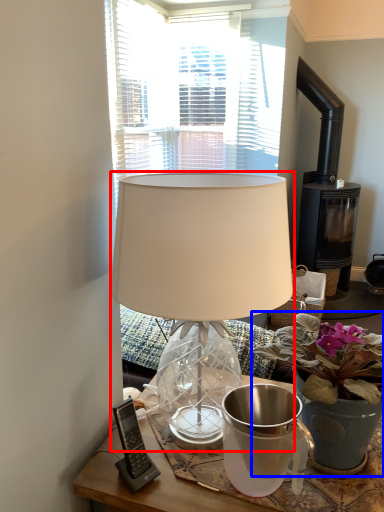
Question: Among these objects, which one is farthest to the camera, lamp (highlighted by a red box) or houseplant (highlighted by a blue box)?

Choices:
 (A) lamp
 (B) houseplant

Answer: (B)